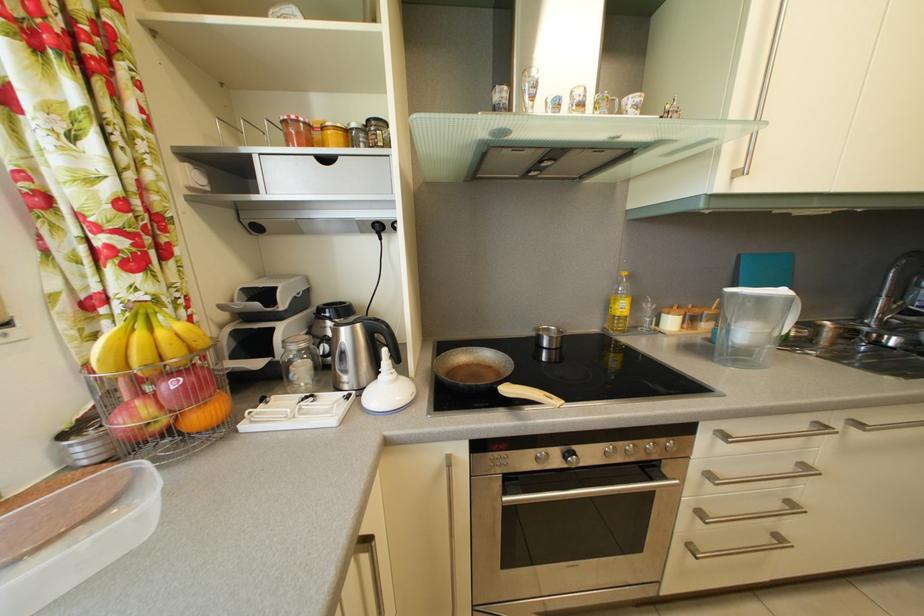
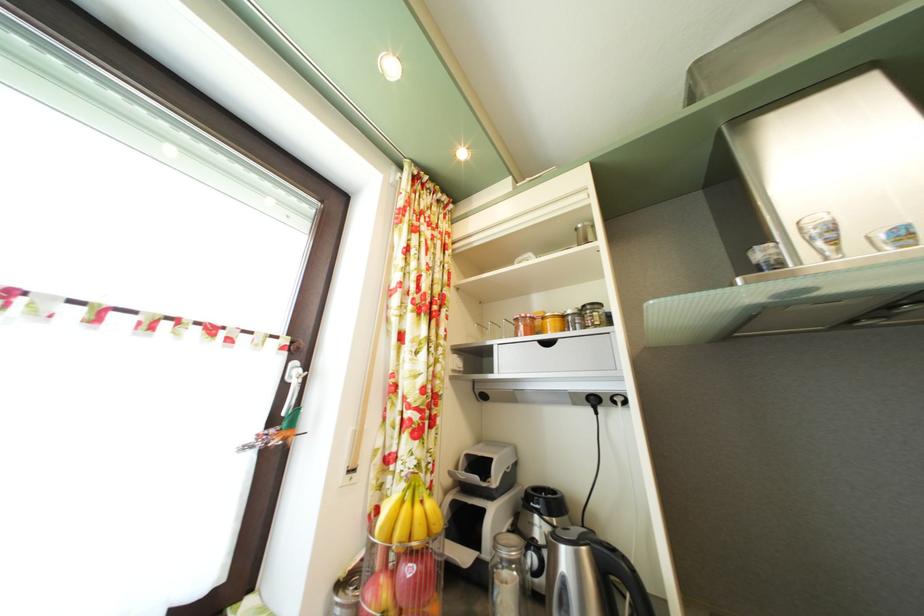
In the second image, find the point that corresponds to (x=304, y=386) in the first image.

(506, 608)